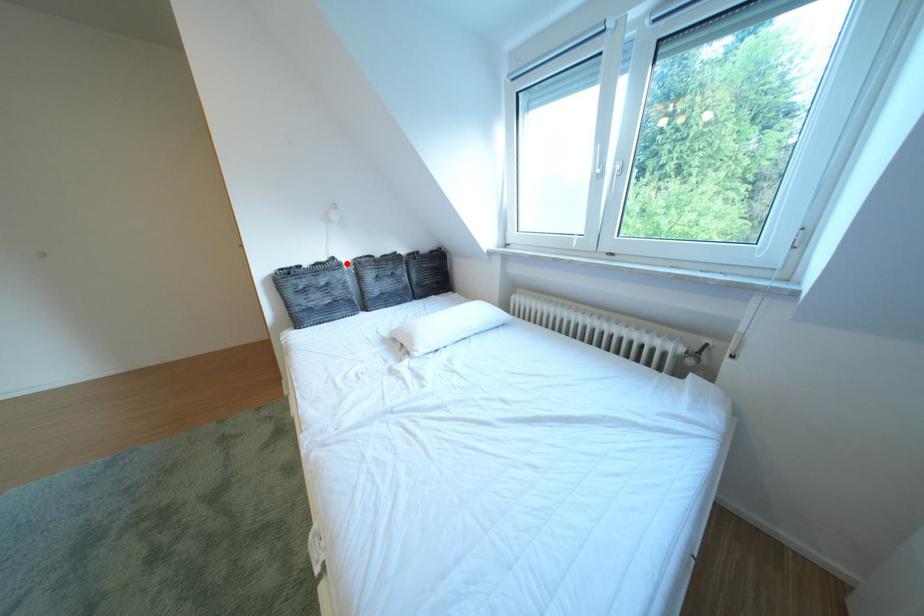
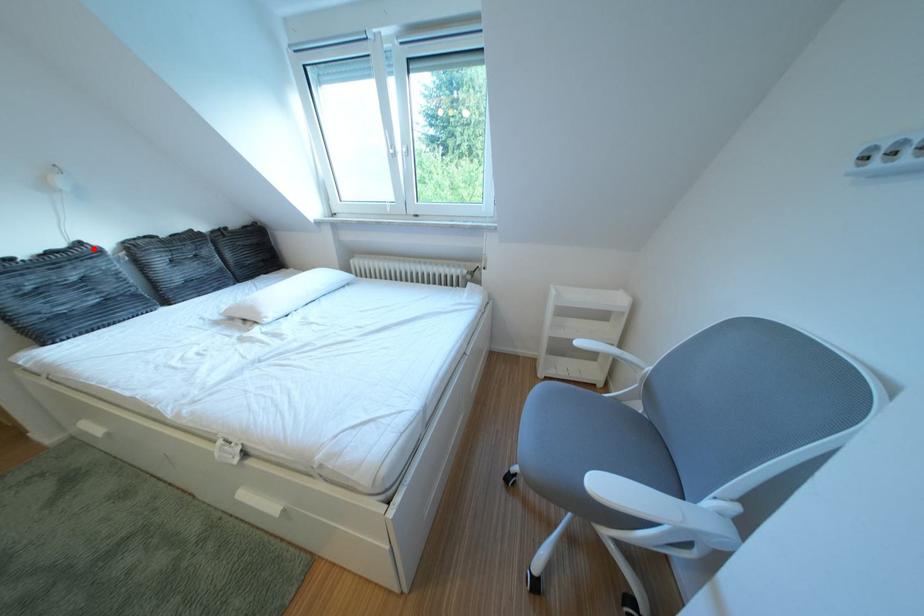
I am providing you with two images of the same scene from different viewpoints. A red point is marked on the first image and another point is marked on the second image. Do the highlighted points in image1 and image2 indicate the same real-world spot?

Yes